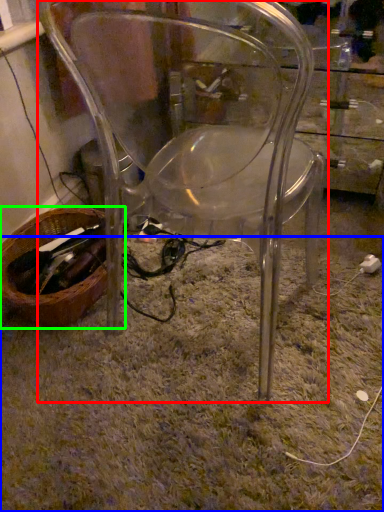
Question: Estimate the real-world distances between objects in this image. Which object is closer to chair (highlighted by a red box), grass (highlighted by a blue box) or basket (highlighted by a green box)?

Choices:
 (A) grass
 (B) basket

Answer: (A)